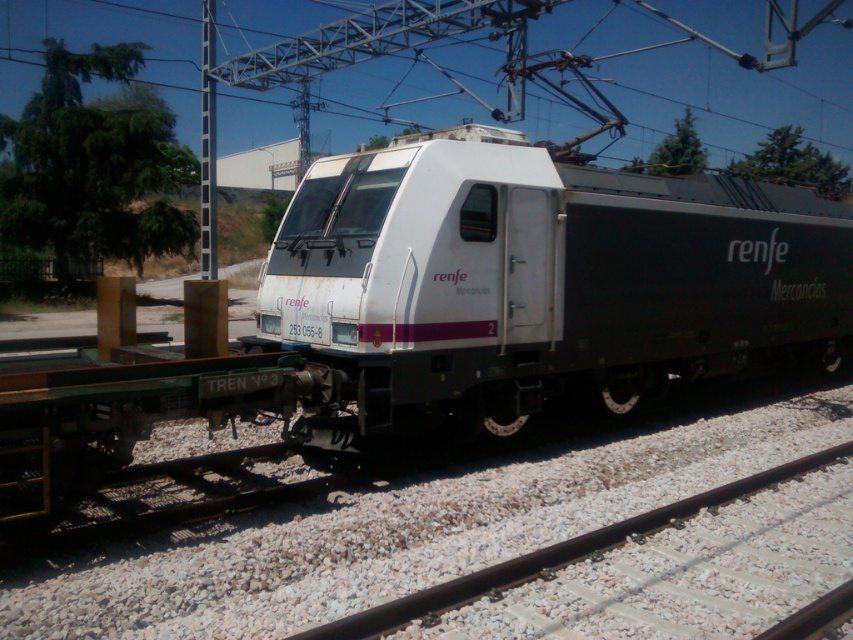
Question: Which object is farther from the camera taking this photo?

Choices:
 (A) black metal train track at lower center
 (B) white matte train at center

Answer: (B)

Question: Does white matte train at center lie in front of black metal train track at lower center?

Choices:
 (A) yes
 (B) no

Answer: (B)

Question: Is white matte train at center bigger than black metal train track at lower center?

Choices:
 (A) yes
 (B) no

Answer: (A)

Question: Is white matte train at center thinner than black metal train track at lower center?

Choices:
 (A) yes
 (B) no

Answer: (B)

Question: Which point appears closest to the camera in this image?

Choices:
 (A) (637, 528)
 (B) (345, 189)

Answer: (A)